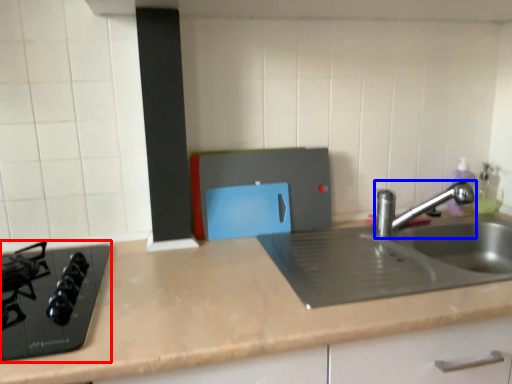
Question: Which point is closer to the camera, gas stove (highlighted by a red box) or tap (highlighted by a blue box)?

Choices:
 (A) gas stove
 (B) tap

Answer: (A)